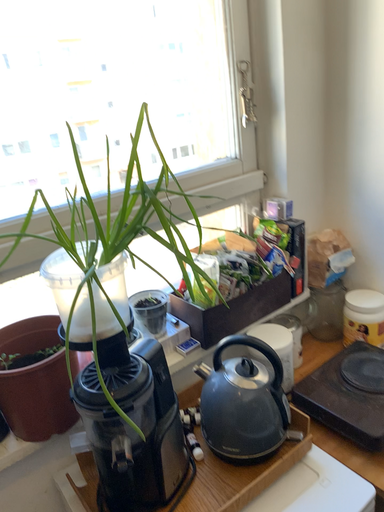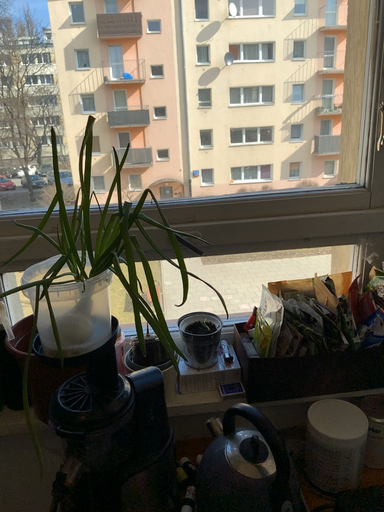
Question: How did the camera likely rotate when shooting the video?

Choices:
 (A) rotated right
 (B) rotated left

Answer: (B)